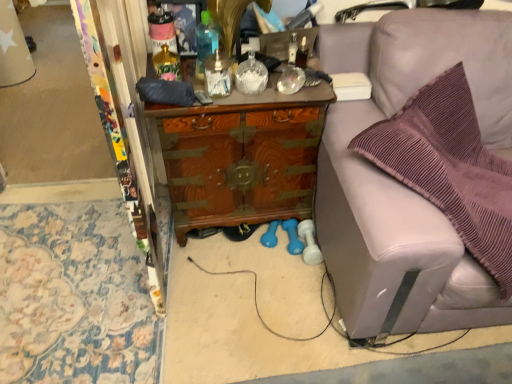
The width and height of the screenshot is (512, 384). I want to click on vacant point to the left of black matte remote control at center, so (x=160, y=96).